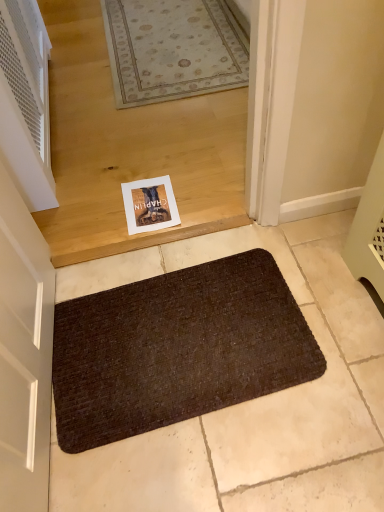
Question: Should I look upward or downward to see white perforated vent at left?

Choices:
 (A) up
 (B) down

Answer: (A)

Question: Is white perforated vent at left not close to brown textured bath mat at lower center?

Choices:
 (A) yes
 (B) no

Answer: (B)

Question: Is brown textured bath mat at lower center inside white perforated vent at left?

Choices:
 (A) no
 (B) yes

Answer: (A)

Question: Considering the relative sizes of white perforated vent at left and brown textured bath mat at lower center in the image provided, is white perforated vent at left smaller than brown textured bath mat at lower center?

Choices:
 (A) yes
 (B) no

Answer: (B)

Question: Considering the relative sizes of white perforated vent at left and brown textured bath mat at lower center in the image provided, is white perforated vent at left shorter than brown textured bath mat at lower center?

Choices:
 (A) no
 (B) yes

Answer: (A)

Question: Is white perforated vent at left completely or partially outside of brown textured bath mat at lower center?

Choices:
 (A) yes
 (B) no

Answer: (A)

Question: From the image's perspective, would you say white perforated vent at left is positioned over brown textured bath mat at lower center?

Choices:
 (A) no
 (B) yes

Answer: (B)

Question: Is brown textured bath mat at lower center smaller than white perforated vent at left?

Choices:
 (A) yes
 (B) no

Answer: (A)

Question: From the image's perspective, is brown textured bath mat at lower center below white perforated vent at left?

Choices:
 (A) no
 (B) yes

Answer: (B)

Question: Is brown textured bath mat at lower center oriented towards white perforated vent at left?

Choices:
 (A) no
 (B) yes

Answer: (A)

Question: Is brown textured bath mat at lower center positioned far away from white perforated vent at left?

Choices:
 (A) yes
 (B) no

Answer: (B)

Question: Considering the relative sizes of brown textured bath mat at lower center and white perforated vent at left in the image provided, is brown textured bath mat at lower center shorter than white perforated vent at left?

Choices:
 (A) no
 (B) yes

Answer: (B)

Question: Is white perforated vent at left inside brown textured bath mat at lower center?

Choices:
 (A) yes
 (B) no

Answer: (B)

Question: Looking at the image, does white perforated vent at left seem bigger or smaller compared to brown textured bath mat at lower center?

Choices:
 (A) small
 (B) big

Answer: (B)